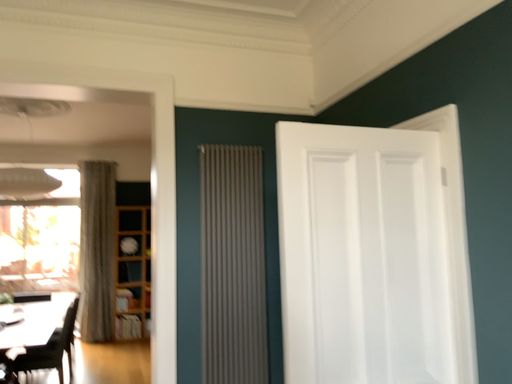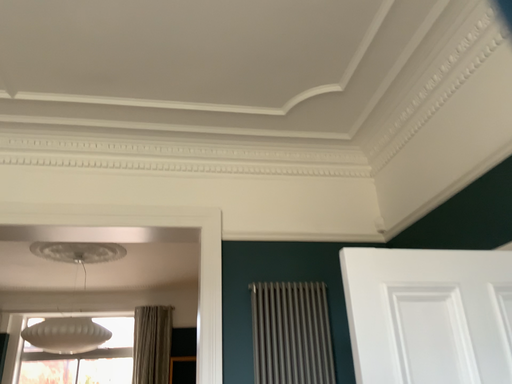
Question: Which way did the camera rotate in the video?

Choices:
 (A) rotated downward
 (B) rotated upward

Answer: (B)